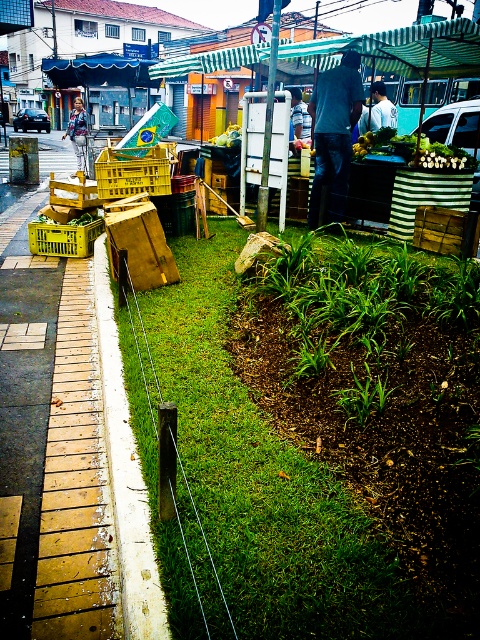
Consider the image. You are a delivery person trying to park your 1.2 meter wide cart between the green grass at center and the yellow plastic crate at center. Can your cart fit in the space between them?

The green grass at center is wider than the yellow plastic crate at center, but the exact width of the space between them isn

You are a delivery person trying to navigate through the urban street scene. You need to move from the white concrete curb at lower left to the yellow plastic crate at center. Which object should you approach first according to their positions?

The white concrete curb at lower left is in front of the yellow plastic crate at center, so you should approach the white concrete curb at lower left first before reaching the yellow plastic crate at center.

You are a delivery person who needs to park your bike near the white concrete curb at lower left and the yellow plastic crate at center. Based on their positions, which object is closer to the right side of the image?

The white concrete curb at lower left is to the right of the yellow plastic crate at center, so the white concrete curb at lower left is closer to the right side of the image.